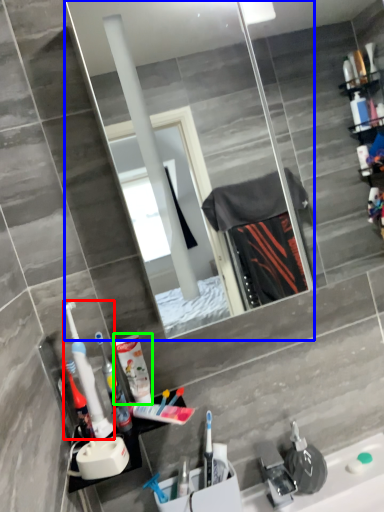
Question: Which is nearer to the toothbrush (highlighted by a red box)? mirror (highlighted by a blue box) or cleaning product (highlighted by a green box).

Choices:
 (A) mirror
 (B) cleaning product

Answer: (B)